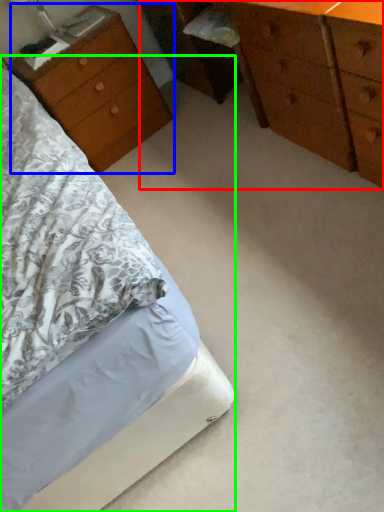
Question: Estimate the real-world distances between objects in this image. Which object is farther from chest of drawers (highlighted by a red box), nightstand (highlighted by a blue box) or bed (highlighted by a green box)?

Choices:
 (A) nightstand
 (B) bed

Answer: (B)